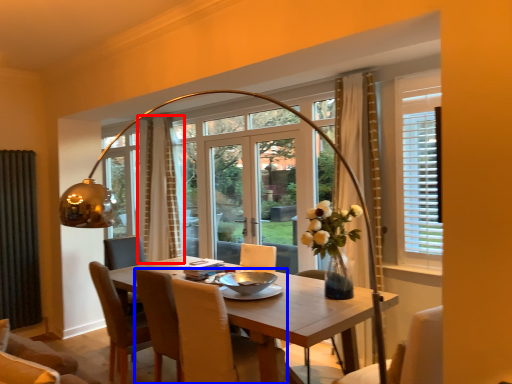
Question: Which point is closer to the camera, curtain (highlighted by a red box) or chair (highlighted by a blue box)?

Choices:
 (A) curtain
 (B) chair

Answer: (B)